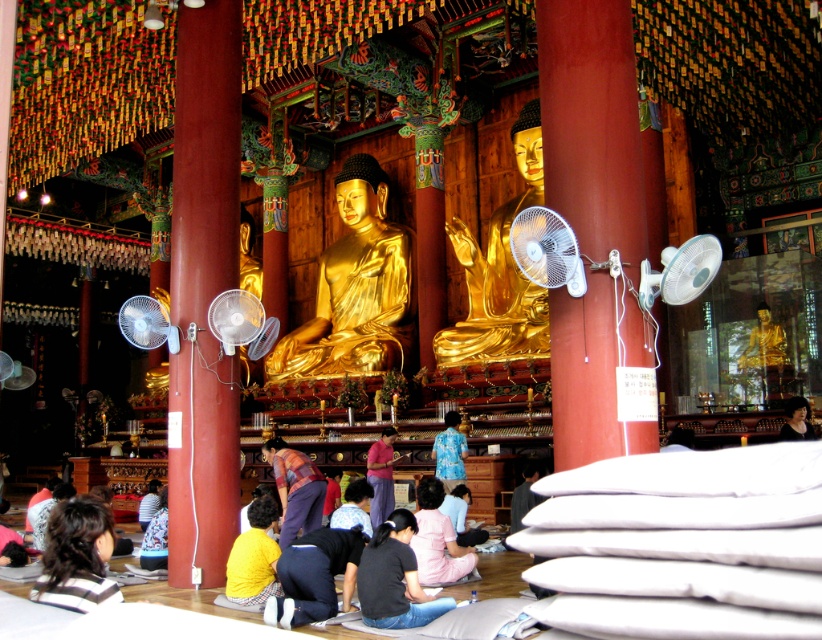
Question: Can you confirm if yellow matte shirt at lower center is positioned to the right of white plastic fan at right?

Choices:
 (A) yes
 (B) no

Answer: (B)

Question: Which point is closer to the camera?

Choices:
 (A) (453, 456)
 (B) (146, 314)
 (C) (239, 595)

Answer: (C)

Question: Which point is farther to the camera?

Choices:
 (A) (353, 496)
 (B) (436, 435)
 (C) (284, 570)

Answer: (B)

Question: Does white plastic fan at center have a greater width compared to white plastic fan at left?

Choices:
 (A) no
 (B) yes

Answer: (A)

Question: Which object is closer to the camera taking this photo?

Choices:
 (A) light pink fabric at lower center
 (B) dark brown hair at lower left
 (C) white plastic fan at center

Answer: (B)

Question: In this image, where is white plastic fan at center located relative to yellow shirt at lower center?

Choices:
 (A) left
 (B) right

Answer: (B)